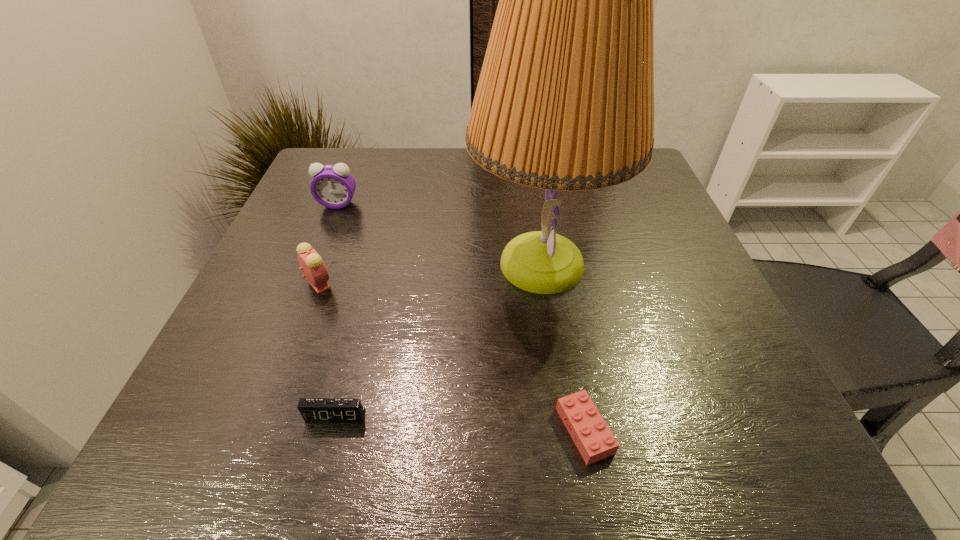
This screenshot has height=540, width=960. I want to click on vacant space located 0.240m on the side of the lamp near the pull switch, so click(352, 264).

The width and height of the screenshot is (960, 540). Identify the location of vacant space situated on the face of the farthest alarm clock. (289, 325).

The height and width of the screenshot is (540, 960). What are the coordinates of `free spot located on the face of the third tallest object` in the screenshot? It's located at (471, 283).

Where is `vacant area located 0.070m on the front-facing side of the rightmost alarm clock`? The image size is (960, 540). vacant area located 0.070m on the front-facing side of the rightmost alarm clock is located at coordinates (322, 470).

You are a GUI agent. You are given a task and a screenshot of the screen. Output one action in this format:
    pyautogui.click(x=<x>, y=<y>)
    Task: Click on the free space located 0.100m on the right of the Lego
    This screenshot has width=960, height=540.
    Given the screenshot: What is the action you would take?
    pyautogui.click(x=678, y=430)

Image resolution: width=960 pixels, height=540 pixels. I want to click on alarm clock that is positioned at the near edge, so point(311,409).

At what (x,y) coordinates should I click in order to perform the action: click on Lego located in the near edge section of the desktop. Please return your answer as a coordinate pair (x, y). Image resolution: width=960 pixels, height=540 pixels. Looking at the image, I should click on (593, 438).

Where is `vacant space at the far edge`? Image resolution: width=960 pixels, height=540 pixels. vacant space at the far edge is located at coordinates (386, 171).

This screenshot has width=960, height=540. In order to click on free space at the near edge in this screenshot , I will do `click(336, 426)`.

Identify the location of vacant space at the left edge of the desktop. This screenshot has width=960, height=540. (302, 350).